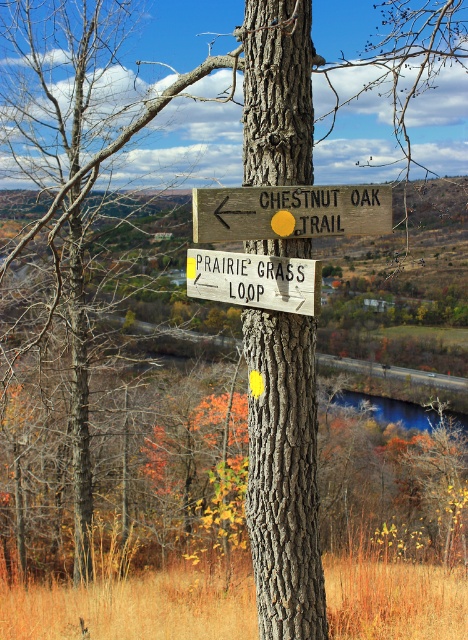
Between gray textured tree trunk at center and white wooden sign at center, which one has less height?

white wooden sign at center

Can you confirm if gray textured tree trunk at center is shorter than white wooden sign at center?

No.

Between point (263, 440) and point (204, 280), which one is positioned behind?

The point (263, 440) is more distant.

The image size is (468, 640). I want to click on gray textured tree trunk at center, so click(x=284, y=474).

Can you confirm if gray textured tree trunk at center is taller than wooden sign at center?

Yes, gray textured tree trunk at center is taller than wooden sign at center.

Is gray textured tree trunk at center shorter than wooden sign at center?

Incorrect, gray textured tree trunk at center's height does not fall short of wooden sign at center's.

Is point (246, 0) farther from viewer compared to point (285, 208)?

Yes, it is behind point (285, 208).

Where is `gray textured tree trunk at center`? The image size is (468, 640). gray textured tree trunk at center is located at coordinates (284, 474).

What are the coordinates of `wooden sign at center` in the screenshot? It's located at (290, 211).

Between wooden sign at center and white wooden sign at center, which one has more height?

With more height is wooden sign at center.

Is point (216, 230) closer to camera compared to point (197, 269)?

Yes, it is in front of point (197, 269).

Locate an element on the screen. This screenshot has width=468, height=640. wooden sign at center is located at coordinates (290, 211).